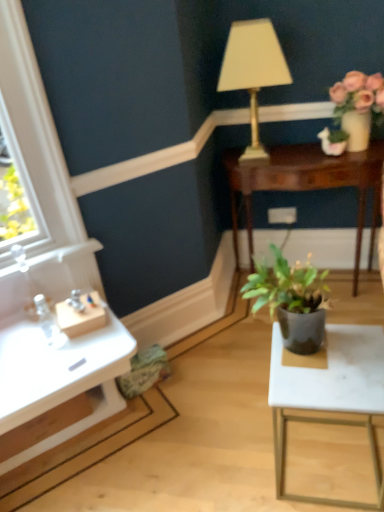
Question: Does gold metallic lamp at upper center have a lesser width compared to dark green matte plant pot at center, acting as the 1th houseplant starting from the left?

Choices:
 (A) yes
 (B) no

Answer: (B)

Question: From a real-world perspective, is gold metallic lamp at upper center over dark green matte plant pot at center, positioned as the first houseplant in front-to-back order?

Choices:
 (A) yes
 (B) no

Answer: (A)

Question: Can you confirm if gold metallic lamp at upper center is taller than dark green matte plant pot at center, the 2th houseplant when ordered from back to front?

Choices:
 (A) no
 (B) yes

Answer: (B)

Question: From the image's perspective, is gold metallic lamp at upper center over dark green matte plant pot at center, which ranks as the second houseplant in top-to-bottom order?

Choices:
 (A) no
 (B) yes

Answer: (B)

Question: Considering the relative sizes of gold metallic lamp at upper center and dark green matte plant pot at center, acting as the 1th houseplant starting from the left, in the image provided, is gold metallic lamp at upper center shorter than dark green matte plant pot at center, acting as the 1th houseplant starting from the left,?

Choices:
 (A) yes
 (B) no

Answer: (B)

Question: Can you confirm if gold metallic lamp at upper center is wider than dark green matte plant pot at center, acting as the 1th houseplant starting from the left?

Choices:
 (A) no
 (B) yes

Answer: (B)

Question: Does mahogany wood table at center, marked as the first table in a back-to-front arrangement, appear on the right side of white marble table at lower right, which is the second table in top-to-bottom order?

Choices:
 (A) no
 (B) yes

Answer: (B)

Question: Can we say mahogany wood table at center, which ranks as the second table in bottom-to-top order, lies outside white marble table at lower right, positioned as the second table in back-to-front order?

Choices:
 (A) no
 (B) yes

Answer: (B)

Question: Does mahogany wood table at center, positioned as the 1th table in top-to-bottom order, have a greater height compared to white marble table at lower right, positioned as the second table in back-to-front order?

Choices:
 (A) yes
 (B) no

Answer: (A)

Question: From a real-world perspective, is mahogany wood table at center, the 2th table in the front-to-back sequence, positioned over white marble table at lower right, positioned as the second table in back-to-front order, based on gravity?

Choices:
 (A) no
 (B) yes

Answer: (B)

Question: From the image's perspective, is mahogany wood table at center, positioned as the 1th table in top-to-bottom order, under white marble table at lower right, positioned as the second table in back-to-front order?

Choices:
 (A) no
 (B) yes

Answer: (A)

Question: Does mahogany wood table at center, positioned as the 1th table in top-to-bottom order, have a larger size compared to white marble table at lower right, which ranks as the first table in front-to-back order?

Choices:
 (A) no
 (B) yes

Answer: (B)

Question: Is white marble table at lower right, which ranks as the first table in front-to-back order, closer to camera compared to gold metallic lamp at upper center?

Choices:
 (A) no
 (B) yes

Answer: (B)